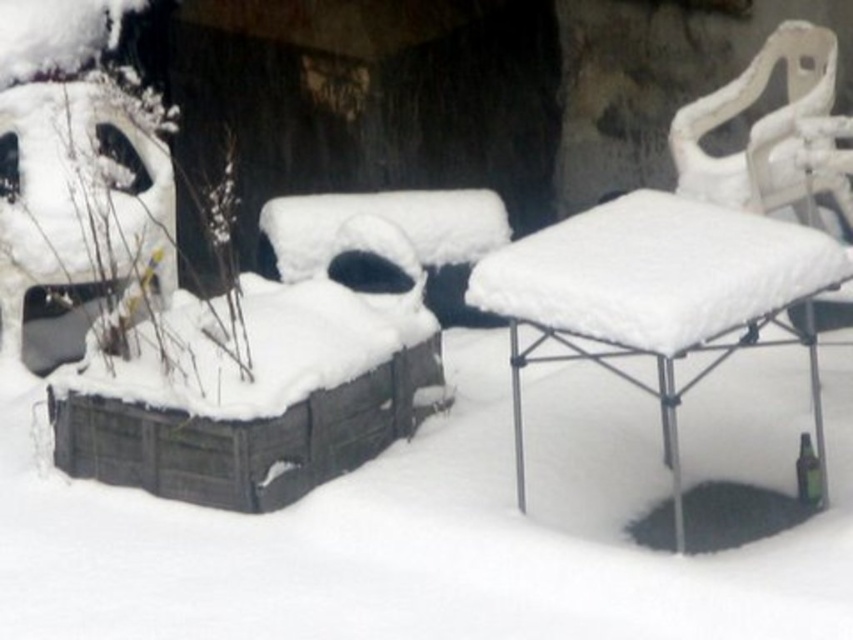
You are planning to place a new white plastic chair at upper right next to the white matte panda at left. Considering their sizes, which object will require more space horizontally?

The white matte panda at left requires more horizontal space because its width is larger than the white plastic chair at upper right.

You are planning to place a new potted plant in the snowy backyard. You want it to be between the white fluffy table at center and the white plastic chair at upper right. Based on their positions, which object should the plant be closer to?

The white fluffy table at center is to the left of the white plastic chair at upper right, so placing the plant between them would require it to be closer to the white fluffy table at center.

You are standing in the snowy backyard and see the white fluffy table at center and the white matte panda at left. Which object is positioned to the right of the other?

The white fluffy table at center is to the right of the white matte panda at left.